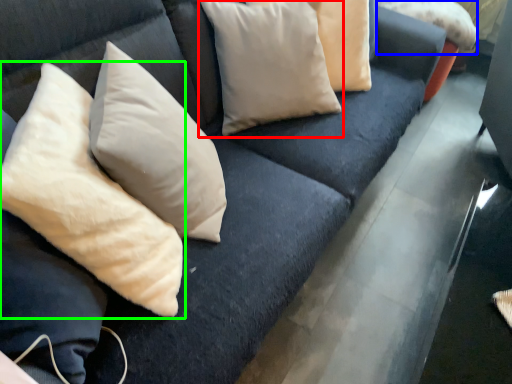
Question: Which object is the farthest from pillow (highlighted by a red box)? Choose among these: pillow (highlighted by a blue box) or pillow (highlighted by a green box).

Choices:
 (A) pillow
 (B) pillow

Answer: (A)